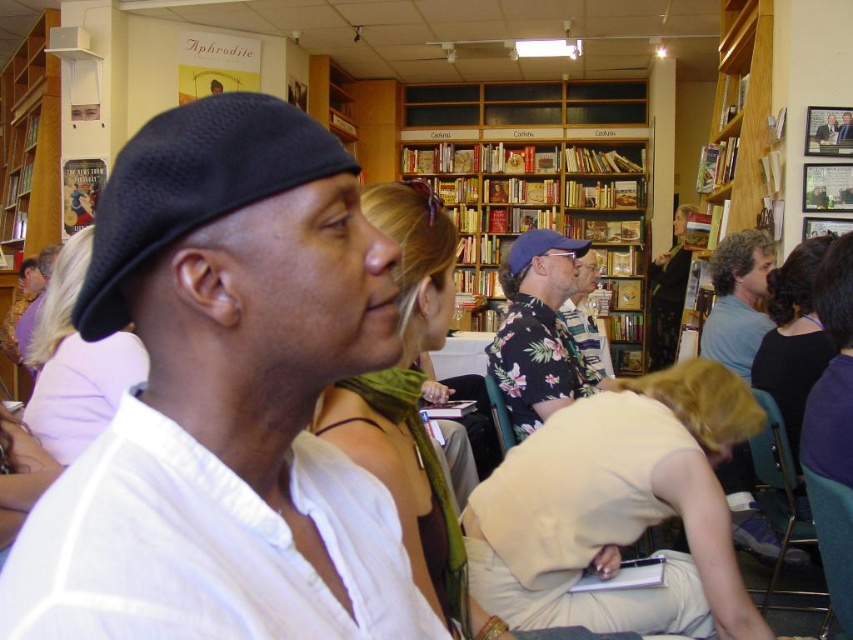
You are a photographer standing in front of the matte black cap at left. You want to take a closeup photo of it without moving the cap. What should you do?

Since the matte black cap at left is 14.97 inches from the camera, you should move closer to the cap to reduce the distance between the camera and the cap to achieve a closeup shot without moving the cap itself.